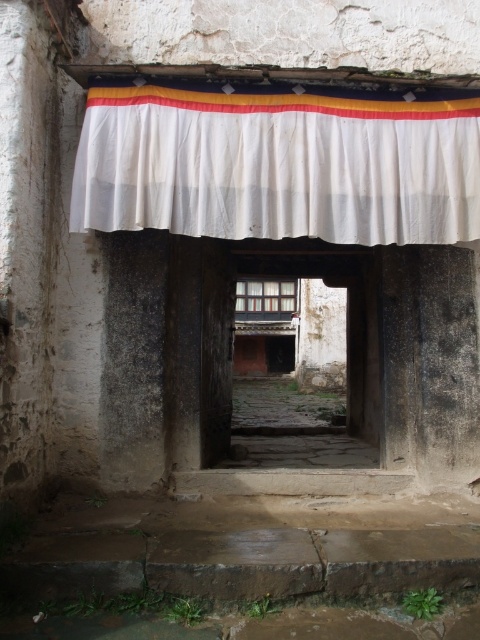
Looking at this image, can you confirm if white fabric curtain at upper center is thinner than wooden door at center?

Incorrect, white fabric curtain at upper center's width is not less than wooden door at center's.

Does white fabric curtain at upper center have a lesser height compared to wooden door at center?

Indeed, white fabric curtain at upper center has a lesser height compared to wooden door at center.

Which is behind, point (381, 164) or point (367, 422)?

Point (367, 422)

I want to click on white fabric curtain at upper center, so click(277, 166).